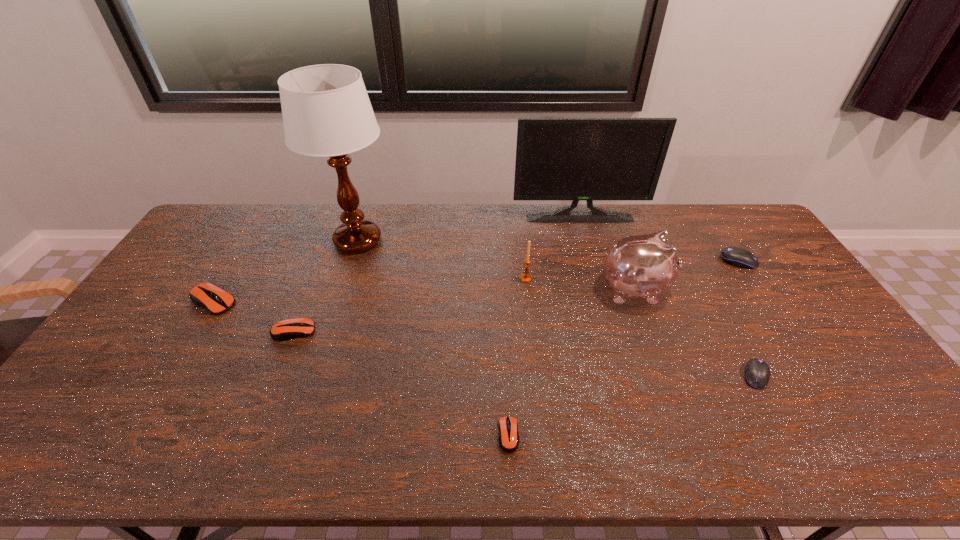
What are the coordinates of `empty space that is in between the monitor and the third computer mouse from left to right` in the screenshot? It's located at (544, 327).

This screenshot has width=960, height=540. What are the coordinates of `free space between the third tallest object and the leftmost object` in the screenshot? It's located at [x=424, y=295].

Image resolution: width=960 pixels, height=540 pixels. I want to click on free space between the second computer mouse from left to right and the leftmost object, so point(253,316).

At what (x,y) coordinates should I click in order to perform the action: click on free space between the candle_holder and the second orange computer mouse from right to left. Please return your answer as a coordinate pair (x, y). The image size is (960, 540). Looking at the image, I should click on (410, 305).

Find the location of a particular element. Image resolution: width=960 pixels, height=540 pixels. the eighth closest object relative to the second farthest computer mouse is located at coordinates (736, 256).

Locate which object is the fourth closest to the farther black computer mouse. Please provide its 2D coordinates. Your answer should be formatted as a tuple, i.e. [(x, y)], where the tuple contains the x and y coordinates of a point satisfying the conditions above.

[(526, 277)]

This screenshot has height=540, width=960. Identify the location of the fourth closest computer mouse to the second farthest orange computer mouse. (736, 256).

Point out which computer mouse is positioned as the fourth nearest to the white table lamp. Please provide its 2D coordinates. Your answer should be formatted as a tuple, i.e. [(x, y)], where the tuple contains the x and y coordinates of a point satisfying the conditions above.

[(757, 373)]

Point out which orange computer mouse is positioned as the second nearest to the seventh shortest object. Please provide its 2D coordinates. Your answer should be formatted as a tuple, i.e. [(x, y)], where the tuple contains the x and y coordinates of a point satisfying the conditions above.

[(288, 329)]

Identify which orange computer mouse is the second nearest to the shortest computer mouse. Please provide its 2D coordinates. Your answer should be formatted as a tuple, i.e. [(x, y)], where the tuple contains the x and y coordinates of a point satisfying the conditions above.

[(209, 296)]